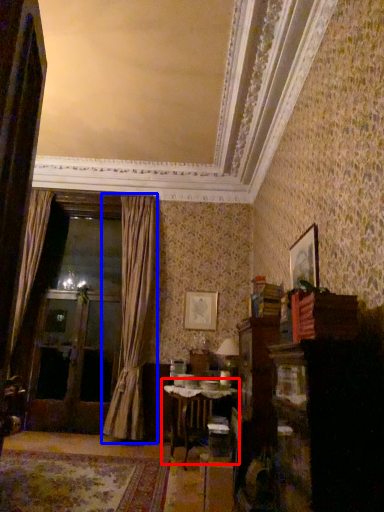
Question: Which object is further to the camera taking this photo, table (highlighted by a red box) or curtain (highlighted by a blue box)?

Choices:
 (A) table
 (B) curtain

Answer: (B)